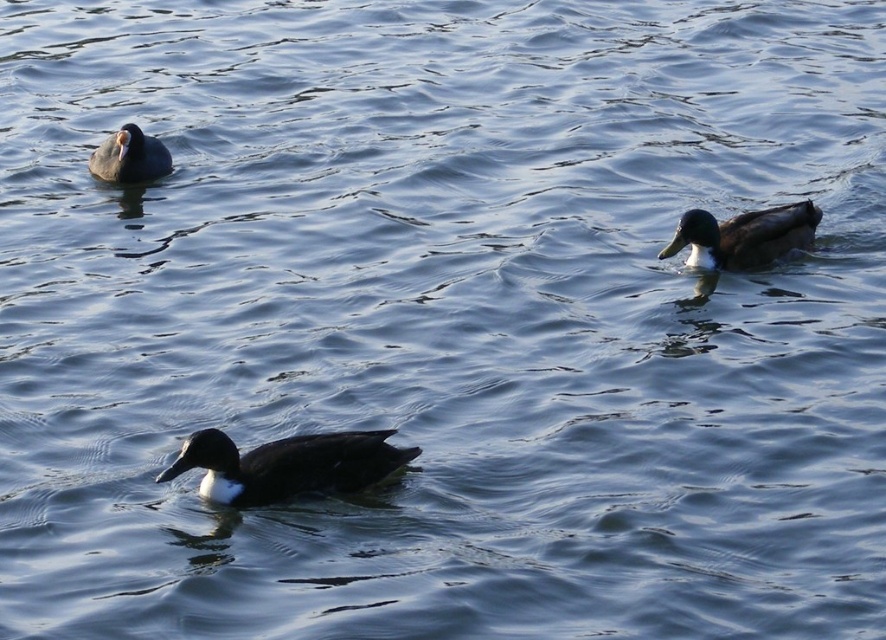
Is point (747, 252) farther from camera compared to point (92, 160)?

That is False.

Between point (782, 248) and point (135, 152), which one is positioned in front?

Point (782, 248) is in front.

I want to click on shiny brown duck at upper right, so click(x=743, y=236).

Between point (400, 449) and point (113, 180), which one is positioned in front?

Point (400, 449)

Between point (224, 467) and point (152, 150), which one is positioned in front?

Point (224, 467)

The height and width of the screenshot is (640, 886). Find the location of `dark brown glossy duck at center`. dark brown glossy duck at center is located at coordinates (286, 465).

In the scene shown: How much distance is there between dark brown glossy duck at center and shiny brown duck at upper right?

The distance of dark brown glossy duck at center from shiny brown duck at upper right is 3.39 meters.

Is dark brown glossy duck at center below shiny brown duck at upper right?

Indeed, dark brown glossy duck at center is positioned under shiny brown duck at upper right.

Locate an element on the screen. dark brown glossy duck at center is located at coordinates (286, 465).